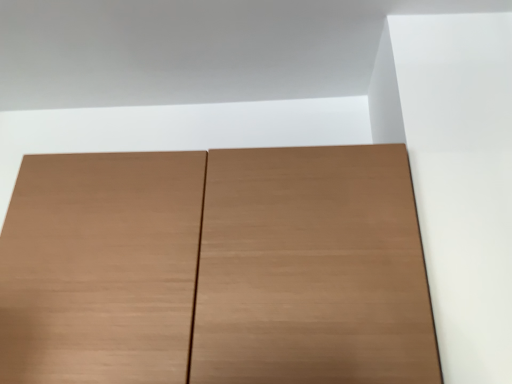
Describe the element at coordinates (216, 269) in the screenshot. I see `wooden cupboard at center` at that location.

Find the location of a particular element. The image size is (512, 384). wooden cupboard at center is located at coordinates (216, 269).

Locate an element on the screen. The height and width of the screenshot is (384, 512). wooden cupboard at center is located at coordinates (216, 269).